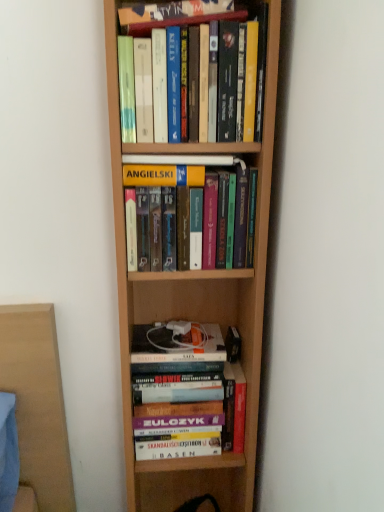
Question: Is wooden bookshelf at lower center to the left of hardcover books at center, which is the third book from top to bottom, from the viewer's perspective?

Choices:
 (A) yes
 (B) no

Answer: (B)

Question: Considering the relative sizes of wooden bookshelf at lower center and hardcover books at center, marked as the second book in a bottom-to-top arrangement, in the image provided, is wooden bookshelf at lower center thinner than hardcover books at center, marked as the second book in a bottom-to-top arrangement,?

Choices:
 (A) no
 (B) yes

Answer: (A)

Question: Could you tell me if wooden bookshelf at lower center is turned towards hardcover books at center, which is the third book from top to bottom?

Choices:
 (A) no
 (B) yes

Answer: (A)

Question: Is wooden bookshelf at lower center closer to the viewer compared to hardcover books at center, which is the third book from top to bottom?

Choices:
 (A) yes
 (B) no

Answer: (B)

Question: Is wooden bookshelf at lower center oriented away from hardcover books at center, which is the third book from top to bottom?

Choices:
 (A) no
 (B) yes

Answer: (A)

Question: Is hardcover books at center, which is the third book from top to bottom, wider or thinner than hardcover books at center, the 1th book when ordered from bottom to top?

Choices:
 (A) wide
 (B) thin

Answer: (B)

Question: Considering the positions of point (137, 162) and point (193, 358), is point (137, 162) closer or farther from the camera than point (193, 358)?

Choices:
 (A) farther
 (B) closer

Answer: (B)

Question: Is hardcover books at center, which is the third book from top to bottom, to the left or to the right of hardcover books at center, the 1th book when ordered from bottom to top, in the image?

Choices:
 (A) right
 (B) left

Answer: (A)

Question: From their relative heights in the image, would you say hardcover books at center, which is the third book from top to bottom, is taller or shorter than hardcover books at center, which ranks as the 4th book in top-to-bottom order?

Choices:
 (A) tall
 (B) short

Answer: (B)

Question: From a real-world perspective, is hardcover books at center, which is the third book from top to bottom, above or below wooden bookshelf at lower center?

Choices:
 (A) above
 (B) below

Answer: (A)

Question: Is hardcover books at center, marked as the second book in a bottom-to-top arrangement, situated inside wooden bookshelf at lower center or outside?

Choices:
 (A) outside
 (B) inside

Answer: (A)

Question: Considering the positions of hardcover books at center, which is the third book from top to bottom, and wooden bookshelf at lower center in the image, is hardcover books at center, which is the third book from top to bottom, wider or thinner than wooden bookshelf at lower center?

Choices:
 (A) thin
 (B) wide

Answer: (A)

Question: From the image's perspective, is hardcover books at center, marked as the second book in a bottom-to-top arrangement, positioned above or below wooden bookshelf at lower center?

Choices:
 (A) below
 (B) above

Answer: (B)

Question: Choose the correct answer: Is wooden bookshelf at lower center inside hardcover books at center, the 1th book when ordered from bottom to top, or outside it?

Choices:
 (A) outside
 (B) inside

Answer: (A)

Question: In terms of width, does wooden bookshelf at lower center look wider or thinner when compared to hardcover books at center, which ranks as the 4th book in top-to-bottom order?

Choices:
 (A) wide
 (B) thin

Answer: (A)